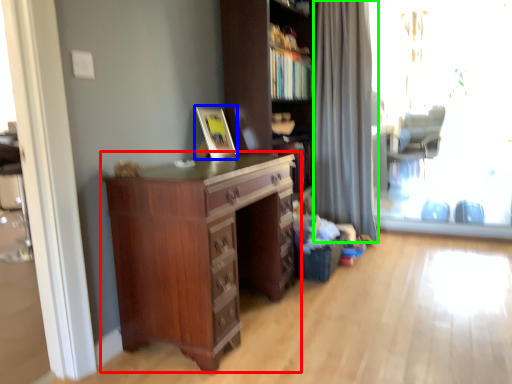
Question: Which object is the farthest from chest of drawers (highlighted by a red box)? Choose among these: picture frame (highlighted by a blue box) or curtain (highlighted by a green box).

Choices:
 (A) picture frame
 (B) curtain

Answer: (B)